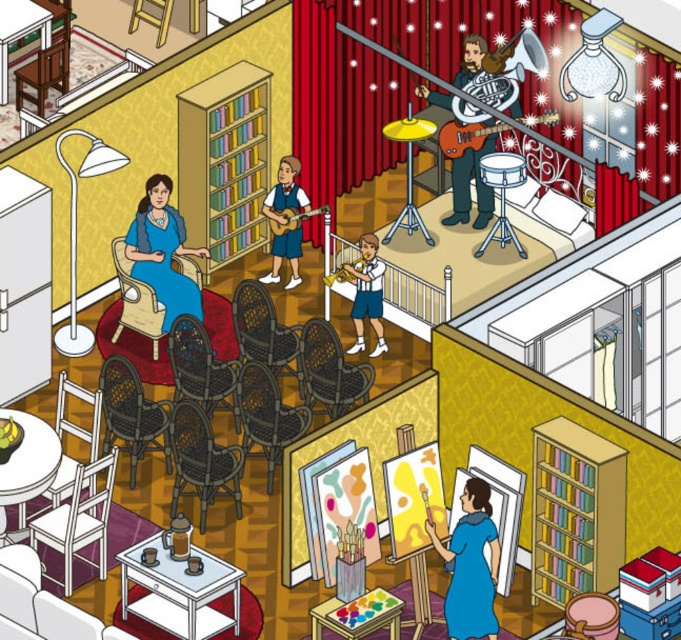
You are a guest in this room and want to place a small plant between the blue fabric dress at lower center and the shiny red guitar at upper center. Based on their positions, which object should the plant be closer to?

The plant should be placed closer to the shiny red guitar at upper center because the blue fabric dress at lower center is positioned on the left side of it.